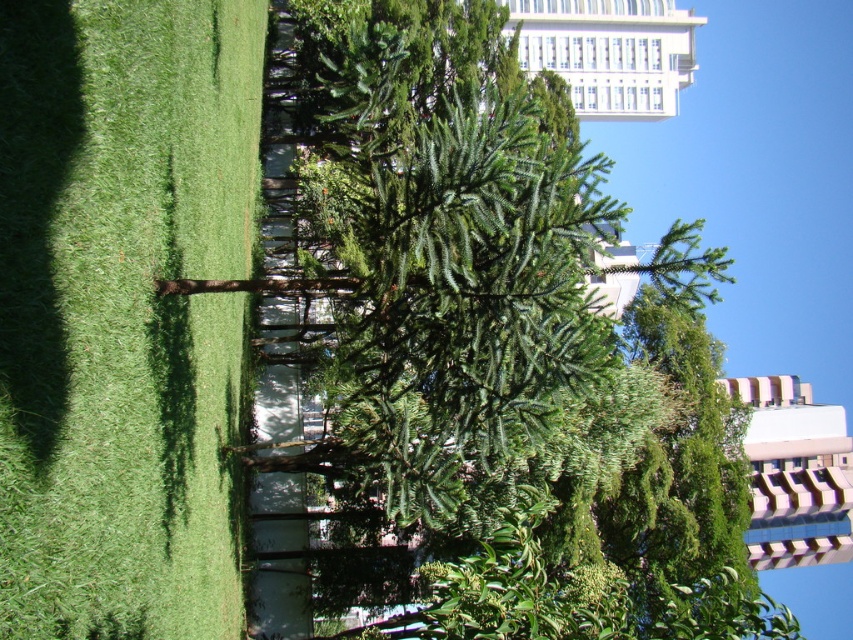
You are an architect analyzing the park layout. You observe the white striped building at upper center and the white glass building at upper center. Which of these two buildings has a narrower width?

The white striped building at upper center is thinner than the white glass building at upper center, so it has a narrower width.

You are a city planner assessing the urban park layout. You need to ensure that the two buildings in the scene, the white striped building at upper center and the white glass building at upper center, are at least 80 meters apart for safety regulations. Based on the scene, do they meet the required distance?

The white striped building at upper center and the white glass building at upper center are 88.90 meters apart, which exceeds the 80 meters requirement. Therefore, they meet the safety regulations.